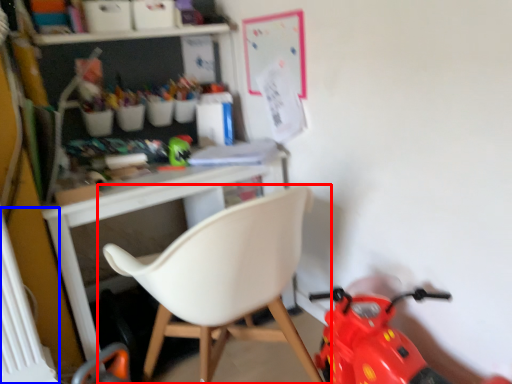
Question: Which object appears closest to the camera in this image, chair (highlighted by a red box) or radiator (highlighted by a blue box)?

Choices:
 (A) chair
 (B) radiator

Answer: (A)